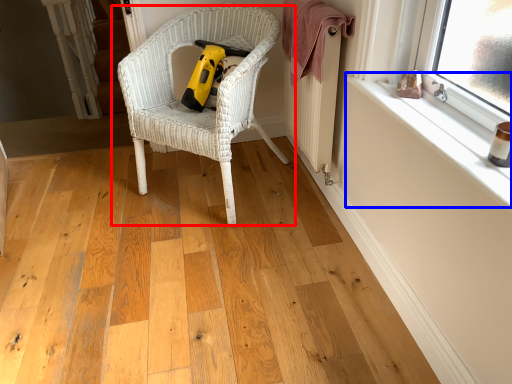
Question: Which object is closer to the camera taking this photo, chair (highlighted by a red box) or window sill (highlighted by a blue box)?

Choices:
 (A) chair
 (B) window sill

Answer: (B)